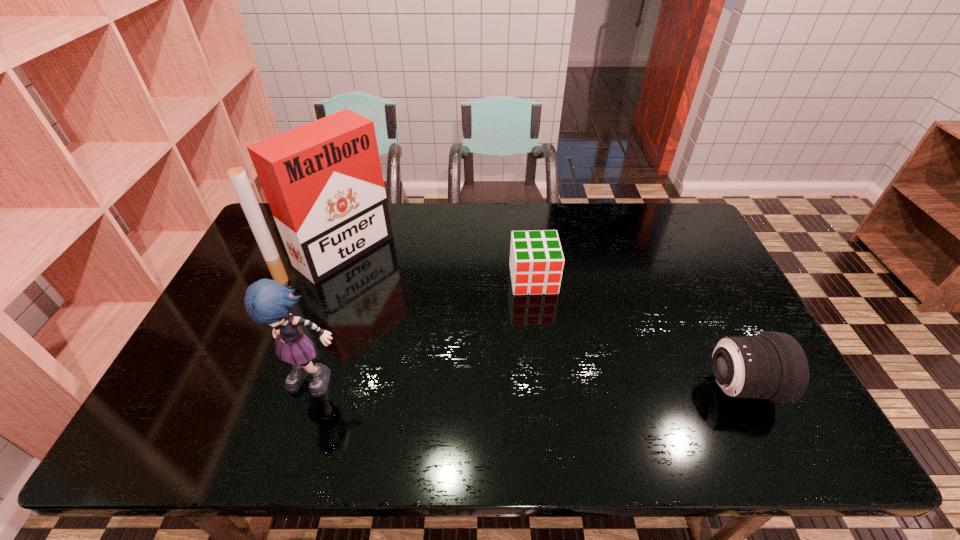
Identify the location of blank space located 0.190m on the red face of the third object from left to right. (545, 347).

This screenshot has width=960, height=540. Identify the location of vacant area situated on the red face of the third object from left to right. (545, 347).

Identify the location of object that is positioned at the far edge. This screenshot has height=540, width=960. (323, 181).

I want to click on rag doll that is at the near edge, so click(266, 301).

Where is `telephoto lens positioned at the near edge`? telephoto lens positioned at the near edge is located at coordinates (772, 365).

Locate an element on the screen. object situated at the left edge is located at coordinates (323, 181).

The image size is (960, 540). I want to click on object positioned at the right edge, so click(x=772, y=365).

I want to click on object present at the far left corner, so click(x=323, y=181).

Find the location of a particular element. object that is at the near right corner is located at coordinates (772, 365).

Identify the location of free spot at the far edge of the desktop. (596, 214).